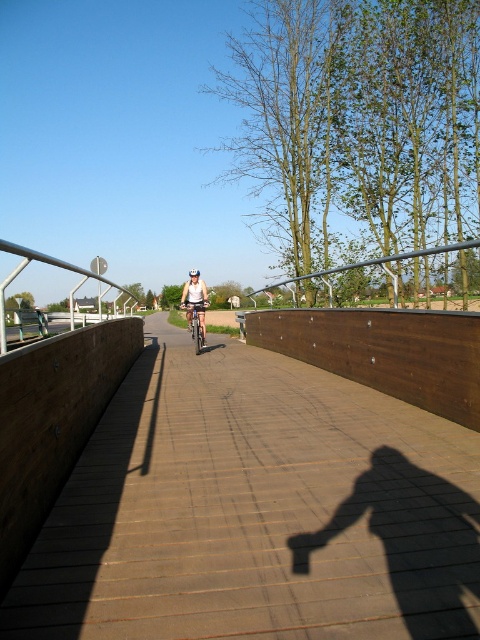
How far apart are white matte helmet at center and white matte bicycle helmet at center?

A distance of 6.11 feet exists between white matte helmet at center and white matte bicycle helmet at center.

Who is more distant from viewer, (184, 305) or (190, 273)?

Positioned behind is point (190, 273).

Who is more distant from viewer, (186, 298) or (195, 273)?

The point (195, 273) is more distant.

Locate an element on the screen. The image size is (480, 640). white matte helmet at center is located at coordinates (194, 301).

From the picture: Is brown wooden path at center thinner than white matte bicycle helmet at center?

Yes, brown wooden path at center is thinner than white matte bicycle helmet at center.

Locate an element on the screen. brown wooden path at center is located at coordinates (255, 509).

Describe the element at coordinates (255, 509) in the screenshot. Image resolution: width=480 pixels, height=640 pixels. I see `brown wooden path at center` at that location.

Identify the location of brown wooden path at center. (255, 509).

Does brown wooden path at center have a lesser width compared to white matte helmet at center?

Incorrect, brown wooden path at center's width is not less than white matte helmet at center's.

Does brown wooden path at center have a larger size compared to white matte helmet at center?

Actually, brown wooden path at center might be smaller than white matte helmet at center.

Does point (328, 432) come farther from viewer compared to point (194, 276)?

That is False.

The width and height of the screenshot is (480, 640). I want to click on brown wooden path at center, so click(255, 509).